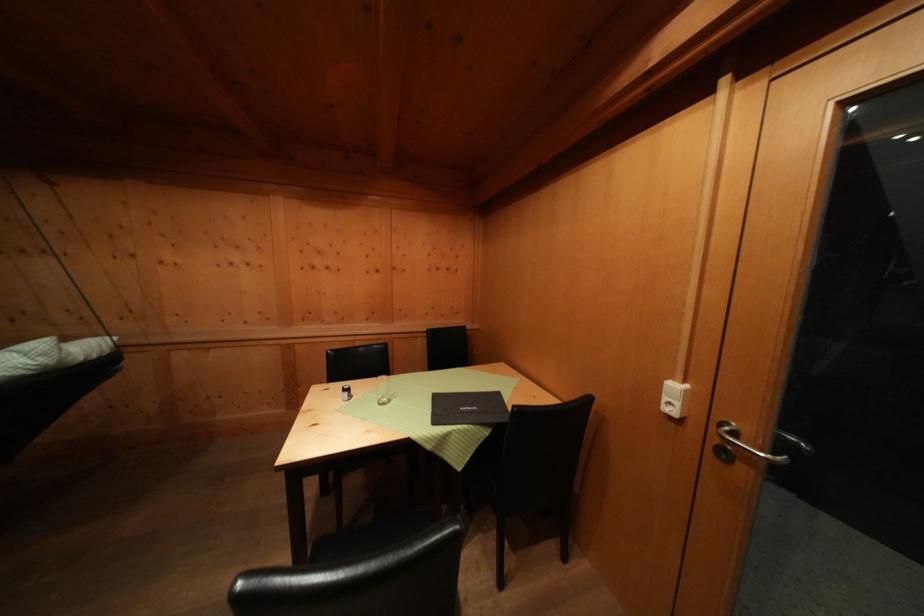
Where would you lift the clear glass? Please return your answer as a coordinate pair (x, y).

(383, 391)